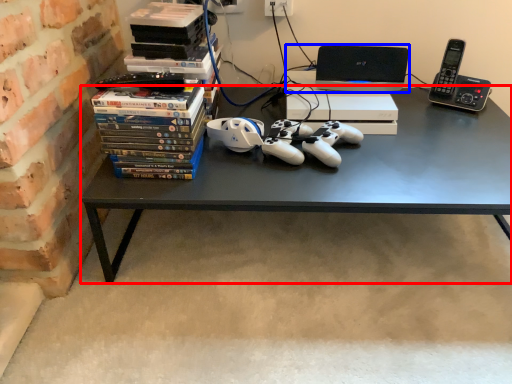
Question: Which of the following is the closest to the observer, desk (highlighted by a red box) or computer (highlighted by a blue box)?

Choices:
 (A) desk
 (B) computer

Answer: (A)